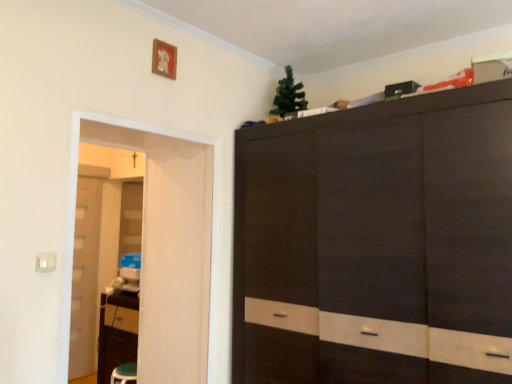
Question: Considering the positions of translucent plastic screen door at left and white glossy door at left in the image, is translucent plastic screen door at left bigger or smaller than white glossy door at left?

Choices:
 (A) big
 (B) small

Answer: (B)

Question: Considering the relative positions of translucent plastic screen door at left and white glossy door at left in the image provided, is translucent plastic screen door at left to the left or to the right of white glossy door at left?

Choices:
 (A) right
 (B) left

Answer: (A)

Question: Looking at their shapes, would you say translucent plastic screen door at left is wider or thinner than white glossy door at left?

Choices:
 (A) wide
 (B) thin

Answer: (B)

Question: Looking at the image, does white glossy door at left seem bigger or smaller compared to translucent plastic screen door at left?

Choices:
 (A) small
 (B) big

Answer: (B)

Question: From their relative heights in the image, would you say white glossy door at left is taller or shorter than translucent plastic screen door at left?

Choices:
 (A) tall
 (B) short

Answer: (A)

Question: Would you say white glossy door at left is to the left or to the right of translucent plastic screen door at left in the picture?

Choices:
 (A) left
 (B) right

Answer: (A)

Question: Relative to translucent plastic screen door at left, is white glossy door at left in front or behind?

Choices:
 (A) behind
 (B) front

Answer: (A)